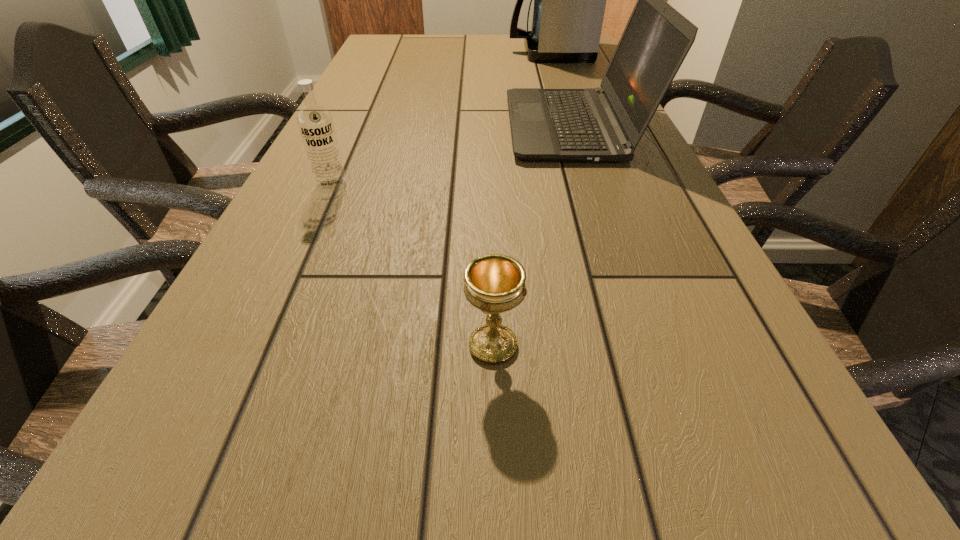
Locate an element on the screen. object located in the far right corner section of the desktop is located at coordinates (569, 0).

Where is `free space at the far edge`? The image size is (960, 540). free space at the far edge is located at coordinates (423, 50).

Image resolution: width=960 pixels, height=540 pixels. In the image, there is a desktop. Identify the location of free space at the left edge. (148, 482).

This screenshot has height=540, width=960. I want to click on vacant space at the right edge, so click(x=587, y=163).

This screenshot has width=960, height=540. I want to click on free location at the far left corner of the desktop, so click(x=375, y=47).

Locate an element on the screen. The height and width of the screenshot is (540, 960). free spot between the leftmost object and the shortest object is located at coordinates (413, 266).

This screenshot has width=960, height=540. I want to click on vacant region between the third nearest object and the nearest object, so click(x=534, y=236).

Where is `free space between the vodka and the third nearest object`? free space between the vodka and the third nearest object is located at coordinates (453, 156).

Locate an element on the screen. free space that is in between the third object from right to left and the second farthest object is located at coordinates (534, 236).

Where is `free space between the chalice and the tallest object`? This screenshot has height=540, width=960. free space between the chalice and the tallest object is located at coordinates pyautogui.click(x=521, y=199).